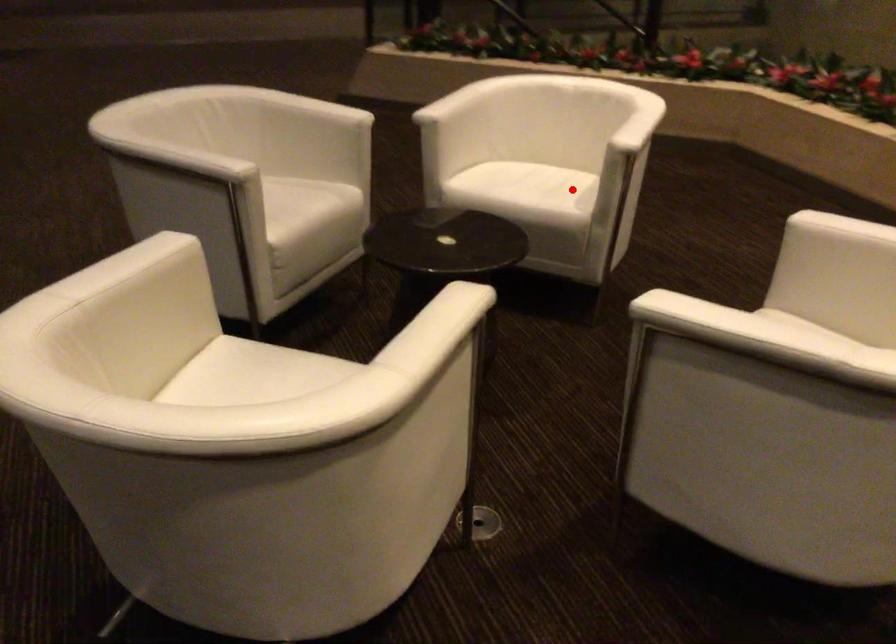
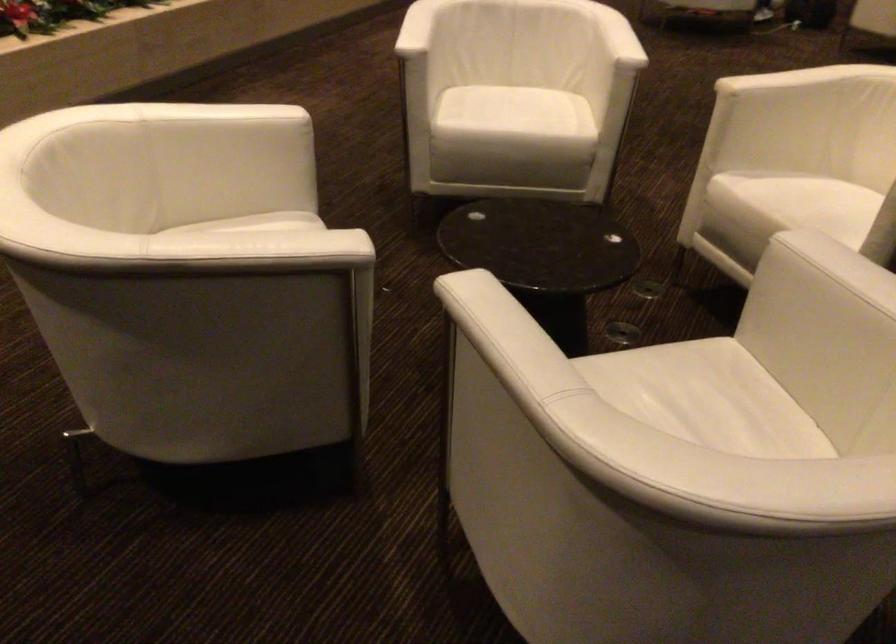
The point at the highlighted location is marked in the first image. Where is the corresponding point in the second image?

(265, 223)